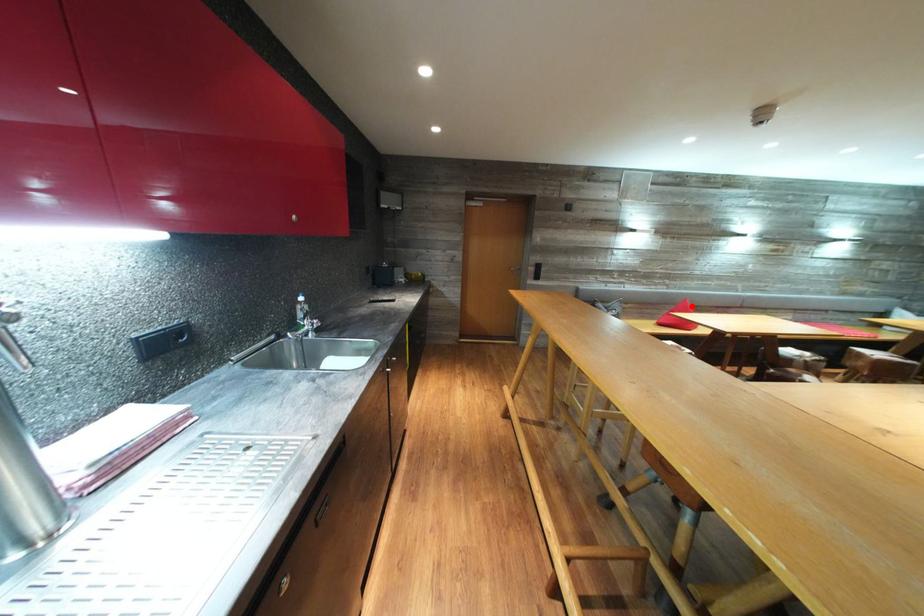
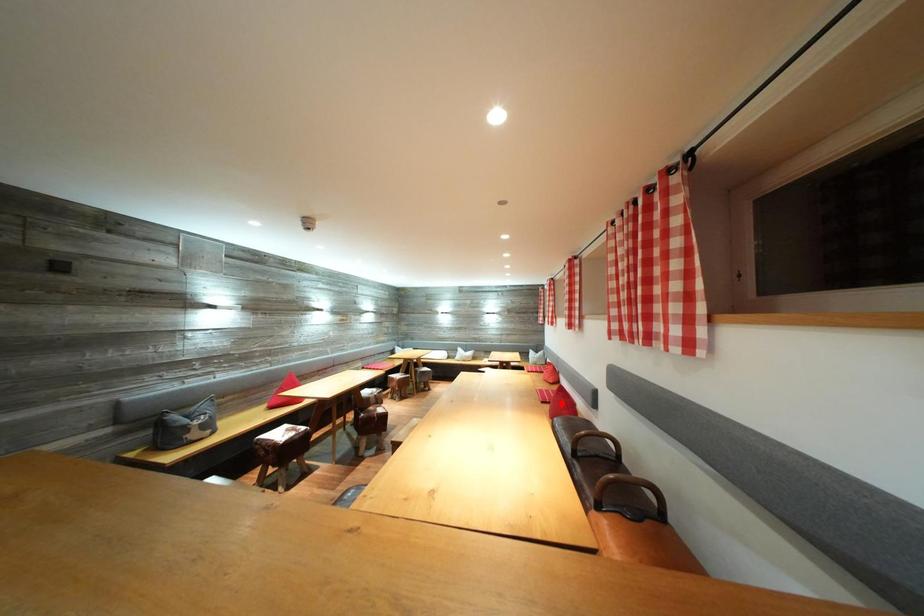
I am providing you with two images of the same scene from different viewpoints. A red point is marked on the first image and another point is marked on the second image. Is the red point in image1 aligned with the point shown in image2?

No